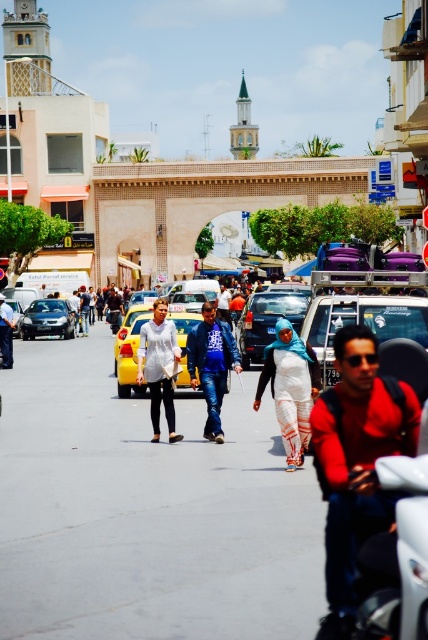
Where is `red matte shirt at center`? This screenshot has height=640, width=428. red matte shirt at center is located at coordinates (356, 461).

Does red matte shirt at center have a greater height compared to yellow matte taxi at center?

Indeed, red matte shirt at center has a greater height compared to yellow matte taxi at center.

What do you see at coordinates (356, 461) in the screenshot? I see `red matte shirt at center` at bounding box center [356, 461].

Where is `red matte shirt at center`? red matte shirt at center is located at coordinates (356, 461).

Does blue denim jeans at center have a smaller size compared to metallic blue car at center?

Indeed, blue denim jeans at center has a smaller size compared to metallic blue car at center.

Between point (216, 372) and point (252, 348), which one is positioned in front?

Point (216, 372) is more forward.

The height and width of the screenshot is (640, 428). Describe the element at coordinates (211, 364) in the screenshot. I see `blue denim jeans at center` at that location.

The height and width of the screenshot is (640, 428). Identify the location of blue denim jeans at center. (211, 364).

Which is behind, point (121, 376) or point (33, 304)?

The point (33, 304) is more distant.

Who is more forward, (131, 324) or (47, 314)?

Positioned in front is point (131, 324).

Which is behind, point (130, 340) or point (47, 301)?

The point (47, 301) is more distant.

Locate an element on the screen. This screenshot has height=640, width=428. yellow matte taxi at center is located at coordinates (128, 358).